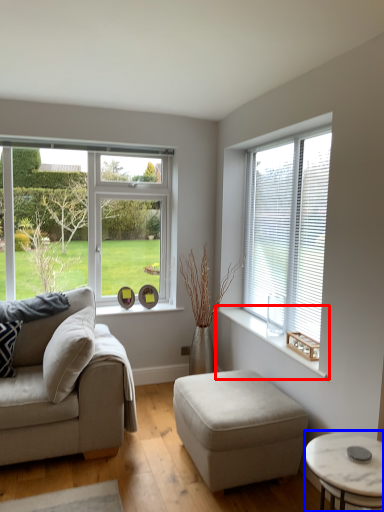
Question: Which object is further to the camera taking this photo, window sill (highlighted by a red box) or coffee table (highlighted by a blue box)?

Choices:
 (A) window sill
 (B) coffee table

Answer: (A)